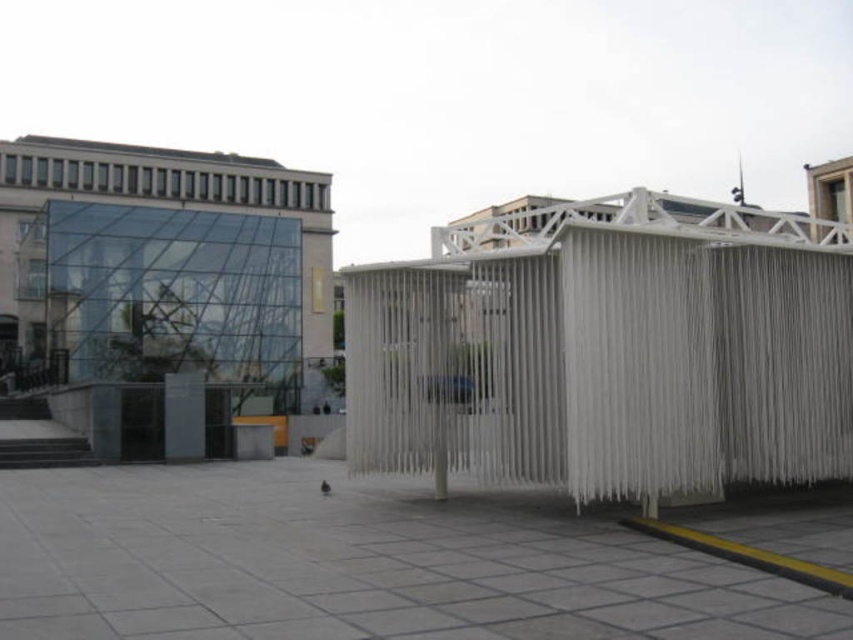
You are an architect designing a new public space and want to place a bench between the white woven structure at center and the transparent glass building at upper left. Based on their widths, which object should the bench be closer to?

The bench should be closer to the transparent glass building at upper left because the white woven structure at center is narrower than the transparent glass building at upper left, meaning there is more space next to the transparent glass building at upper left for the bench.